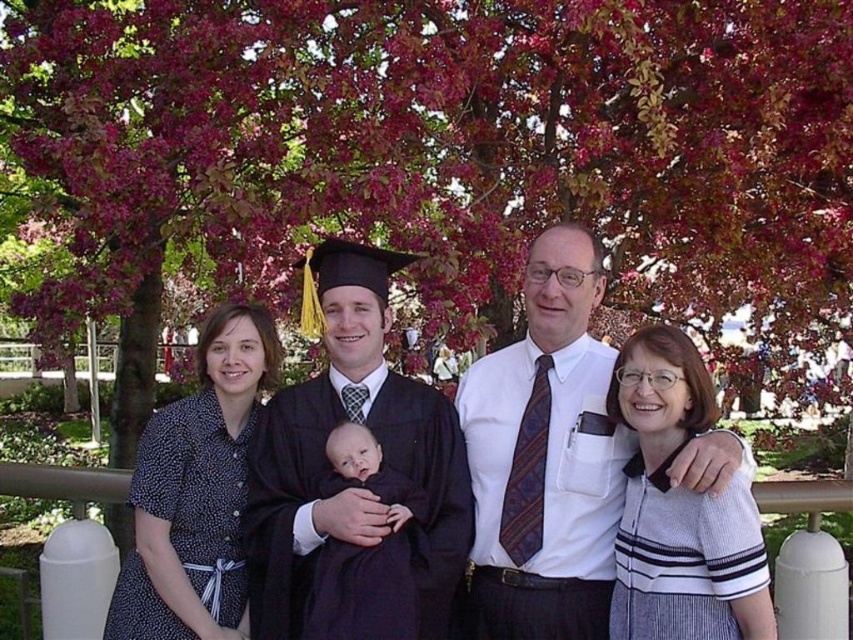
Question: Which object is positioned closest to the smooth dark fabric baby at center?

Choices:
 (A) black dotted dress at left
 (B) matte black graduation gown at center
 (C) matte black gown at center

Answer: (B)

Question: Which object is positioned closest to the dark blue fabric baby at center?

Choices:
 (A) white smooth shirt at center
 (B) white striped sweater at center
 (C) black dotted dress at left
 (D) smooth dark fabric baby at center

Answer: (D)

Question: Does white smooth shirt at center appear on the right side of dark blue fabric baby at center?

Choices:
 (A) no
 (B) yes

Answer: (B)

Question: Which point is closer to the camera?

Choices:
 (A) (161, 602)
 (B) (647, 532)
 (C) (508, 547)
 (D) (355, 467)

Answer: (B)

Question: Can you confirm if matte black graduation gown at center is smaller than dark blue fabric baby at center?

Choices:
 (A) yes
 (B) no

Answer: (B)

Question: Is white striped sweater at center below dark blue fabric baby at center?

Choices:
 (A) no
 (B) yes

Answer: (A)